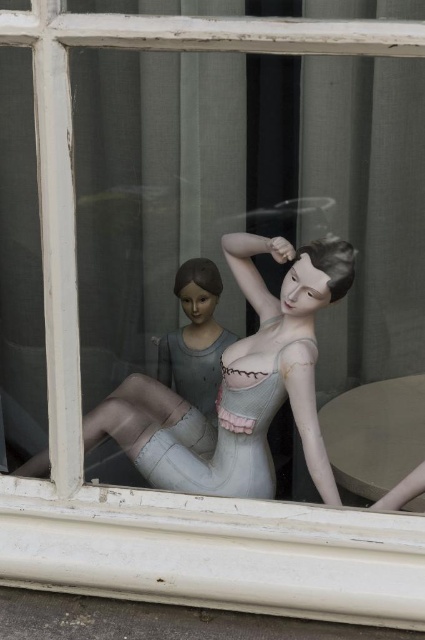
Which is above, matte white mannequin at center or matte gray doll at center?

Positioned higher is matte gray doll at center.

Is point (283, 301) farther from camera compared to point (221, 348)?

No.

Locate an element on the screen. The image size is (425, 640). matte white mannequin at center is located at coordinates (238, 385).

Between white painted wood at lower center and matte white mannequin at center, which one is positioned higher?

matte white mannequin at center is higher up.

Between point (31, 577) and point (314, 314), which one is positioned in front?

Positioned in front is point (31, 577).

I want to click on white painted wood at lower center, so click(x=215, y=552).

Is white painted wood at lower center shorter than matte gray doll at center?

Correct, white painted wood at lower center is not as tall as matte gray doll at center.

Find the location of a particular element. white painted wood at lower center is located at coordinates click(215, 552).